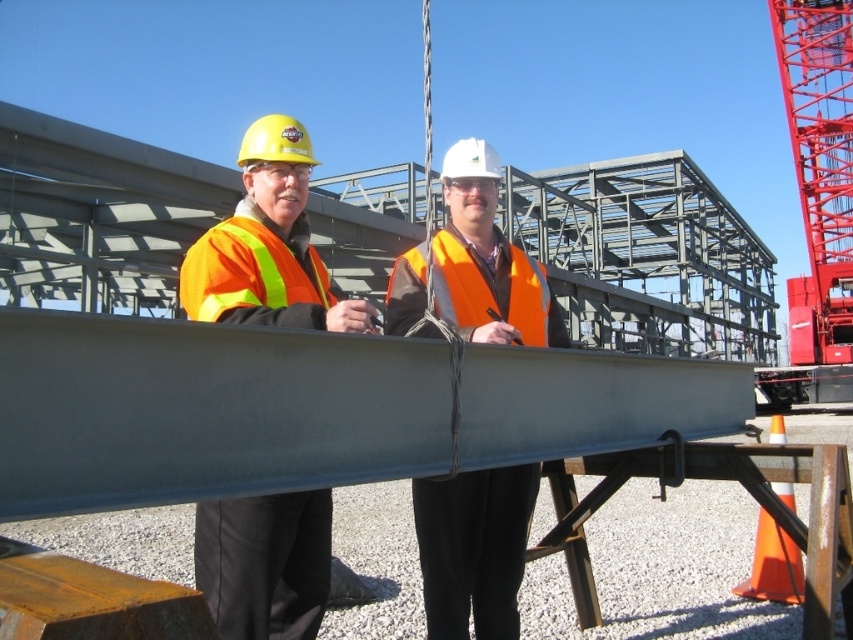
Consider the image. You are a safety inspector at the construction site shown. You need to determine if the orange reflective safety vest at left is taller than the orange reflective safety vest at center. Based on the scene, what is your conclusion?

The orange reflective safety vest at left is shorter than orange reflective safety vest at center, so the vest at left is not taller than the one at center.

You are a safety inspector at the construction site. You need to ensure that the orange reflective vest at center and the orange reflective safety vest at center comply with the size requirements. According to the safety regulations, the vest must be at least 0.5 meters in width. Which of the two vests is more likely to meet the regulation?

The orange reflective vest at center is bigger than orange reflective safety vest at center, so the orange reflective vest at center is more likely to meet the regulation requirement of being at least 0.5 meters in width.